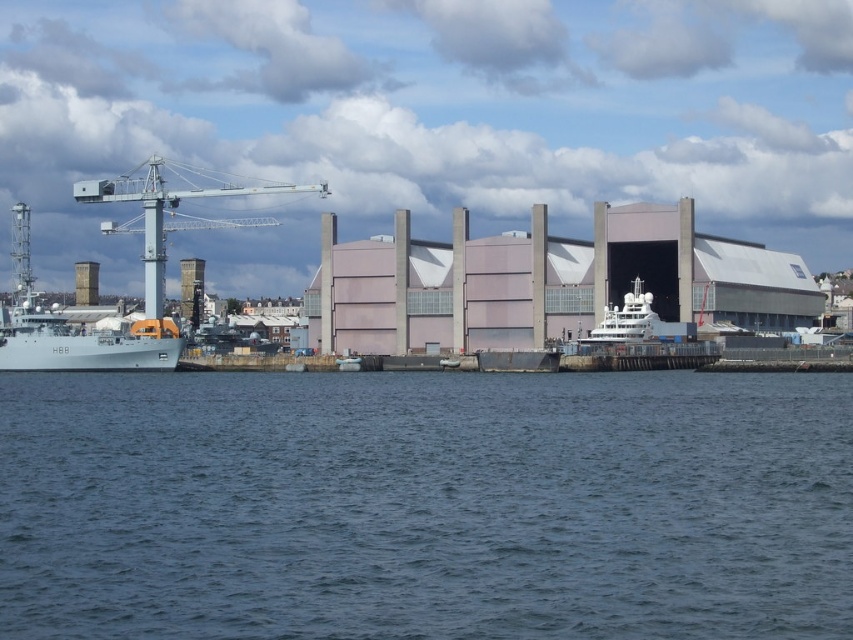
Question: Which object appears closest to the camera in this image?

Choices:
 (A) blue water at lower center
 (B) metallic gray crane at upper left

Answer: (A)

Question: Which point is closer to the camera taking this photo?

Choices:
 (A) (579, 337)
 (B) (25, 566)

Answer: (B)

Question: Which object is positioned closest to the blue water at lower center?

Choices:
 (A) gray metallic ship at left
 (B) metallic gray crane at upper left
 (C) shiny silver yacht at center

Answer: (C)

Question: Can you confirm if blue water at lower center is bigger than metallic gray crane at upper left?

Choices:
 (A) yes
 (B) no

Answer: (B)

Question: Where is blue water at lower center located in relation to metallic gray crane at upper left in the image?

Choices:
 (A) below
 (B) above

Answer: (A)

Question: Does blue water at lower center appear over gray metallic ship at left?

Choices:
 (A) no
 (B) yes

Answer: (A)